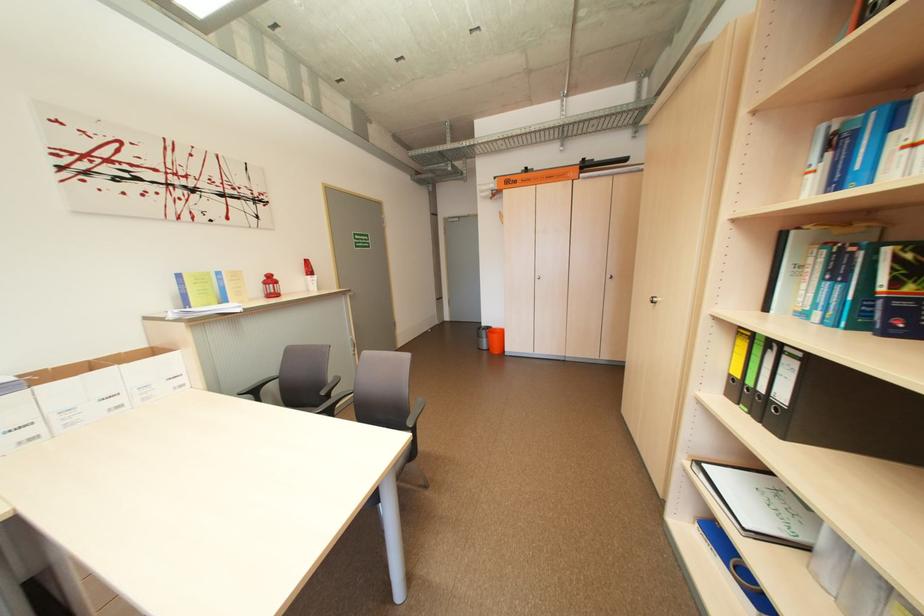
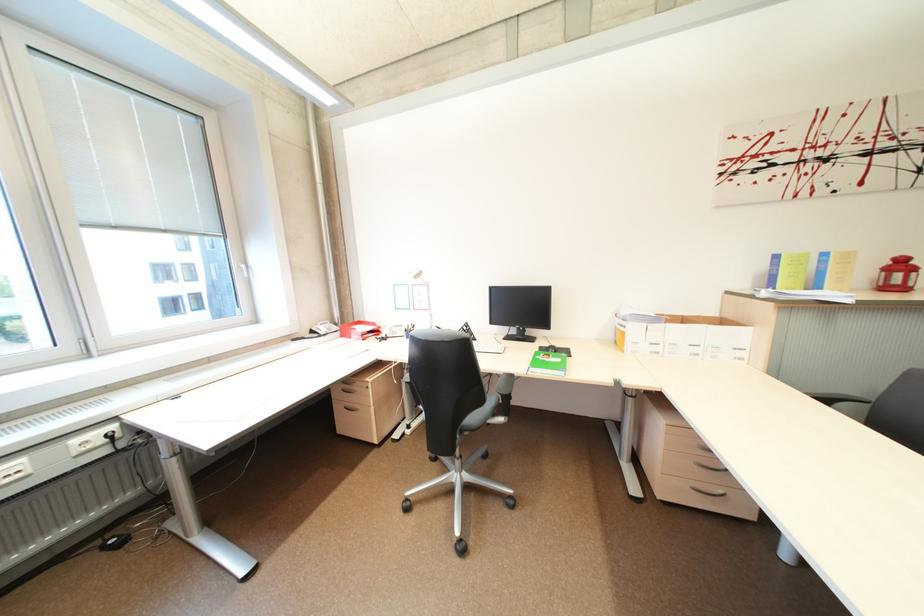
In the second image, find the point that corresponds to (x=280, y=281) in the first image.

(910, 265)